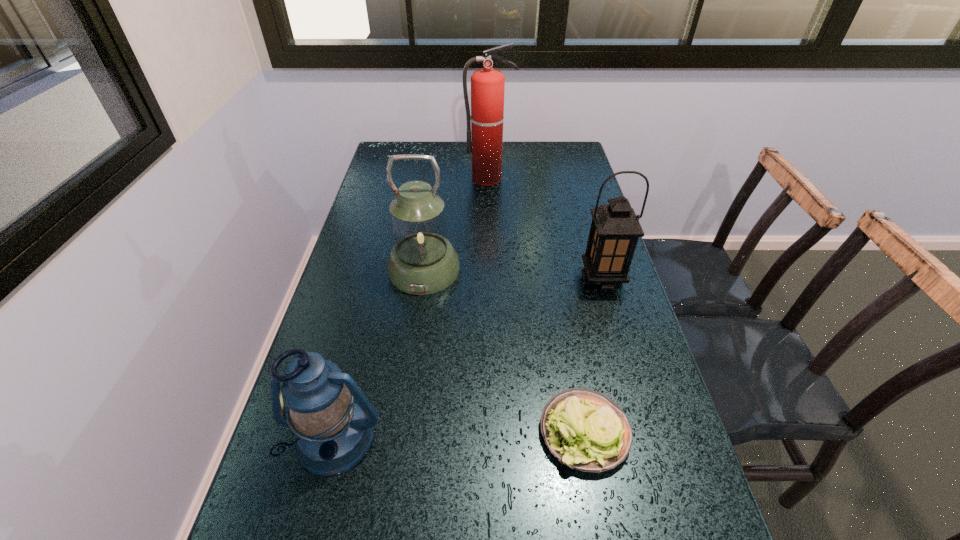
Select which object is the fourth closest to the rightmost lantern. Please provide its 2D coordinates. Your answer should be formatted as a tuple, i.e. [(x, y)], where the tuple contains the x and y coordinates of a point satisfying the conditions above.

[(334, 434)]

Find the location of `the second closest lantern to the shortest object`. the second closest lantern to the shortest object is located at coordinates (334, 434).

Identify the location of lantern that is the closest to the shortest lantern. The image size is (960, 540). (422, 261).

Identify the location of vacant space that satisfies the following two spatial constraints: 1. with the nozzle and gauge on the fire extinguisher; 2. on the left side of the shortest object. (495, 431).